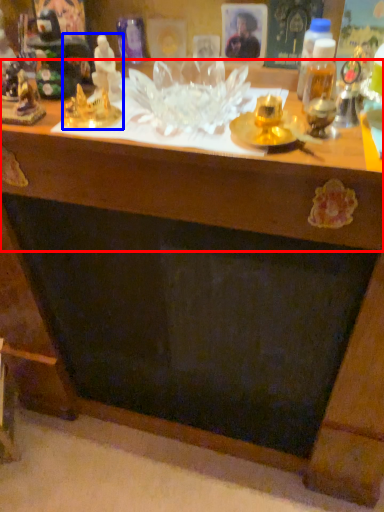
Question: Which object appears closest to the camera in this image, table (highlighted by a red box) or toy (highlighted by a blue box)?

Choices:
 (A) table
 (B) toy

Answer: (A)